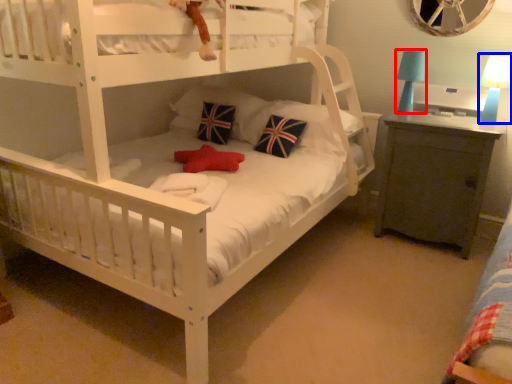
Question: Which of the following is the closest to the observer, table lamp (highlighted by a red box) or table lamp (highlighted by a blue box)?

Choices:
 (A) table lamp
 (B) table lamp

Answer: (B)